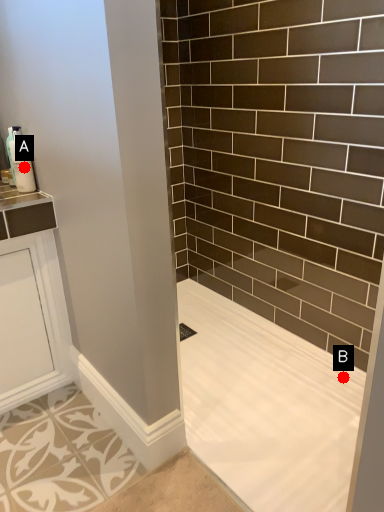
Question: Two points are circled on the image, labeled by A and B beside each circle. Among these points, which one is nearest to the camera?

Choices:
 (A) A is closer
 (B) B is closer

Answer: (A)